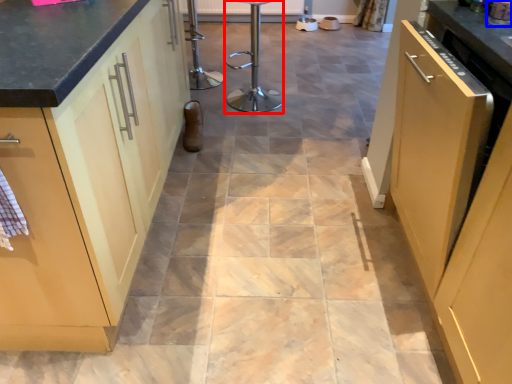
Question: Among these objects, which one is farthest to the camera, bar stool (highlighted by a red box) or appliance (highlighted by a blue box)?

Choices:
 (A) bar stool
 (B) appliance

Answer: (A)